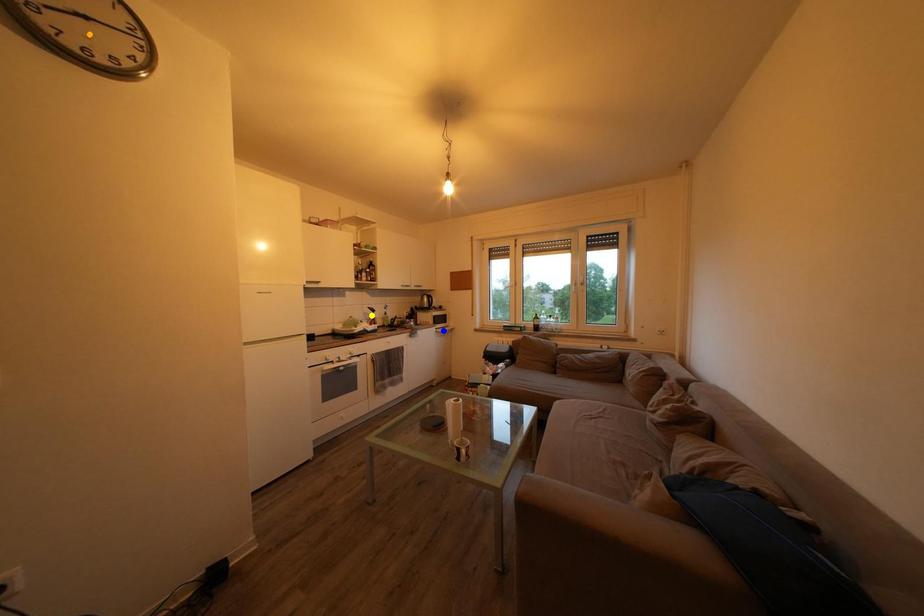
Order these from nearest to farthest:
1. yellow point
2. orange point
3. blue point

orange point → yellow point → blue point